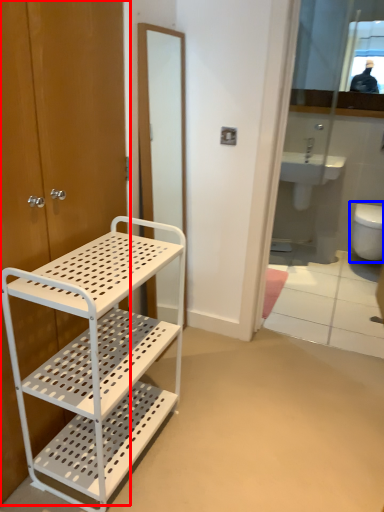
Question: Among these objects, which one is farthest to the camera, door (highlighted by a red box) or toilet (highlighted by a blue box)?

Choices:
 (A) door
 (B) toilet

Answer: (B)